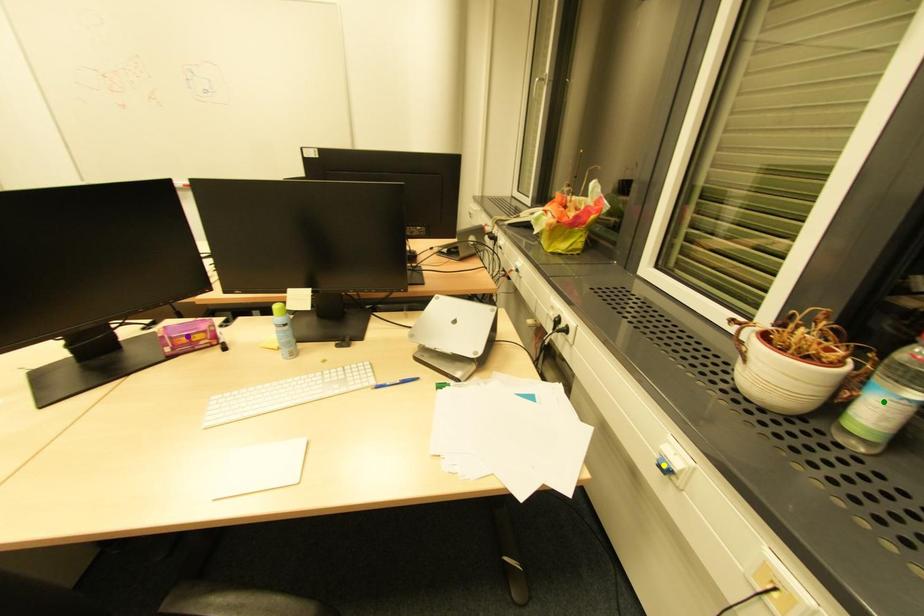
Order these from nearest to farthest:
yellow point, purple point, green point

green point → yellow point → purple point